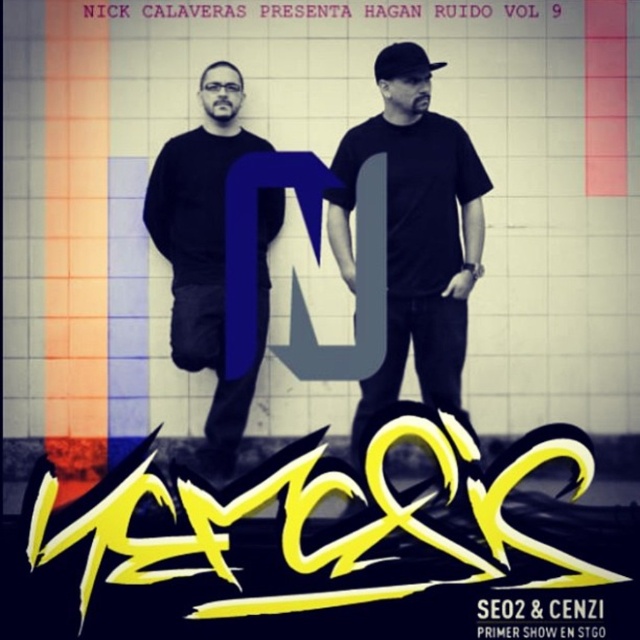
Question: Which point is farther to the camera?

Choices:
 (A) blacktexturedwriting at center
 (B) black matte shirt at center

Answer: (B)

Question: Which is nearer to the white paper text at upper center?

Choices:
 (A) black matte shirt at center
 (B) blacktexturedwriting at center
 (C) black matte t-shirt at center
 (D) black matte baseball cap at upper center

Answer: (D)

Question: Can you confirm if black matte t-shirt at center is thinner than black matte shirt at center?

Choices:
 (A) no
 (B) yes

Answer: (A)

Question: Which of these objects is positioned farthest from the black matte baseball cap at upper center?

Choices:
 (A) white paper text at upper center
 (B) blacktexturedwriting at center

Answer: (B)

Question: Is white paper text at upper center to the left of black matte baseball cap at upper center from the viewer's perspective?

Choices:
 (A) yes
 (B) no

Answer: (A)

Question: Can you confirm if black matte t-shirt at center is thinner than black matte baseball cap at upper center?

Choices:
 (A) yes
 (B) no

Answer: (B)